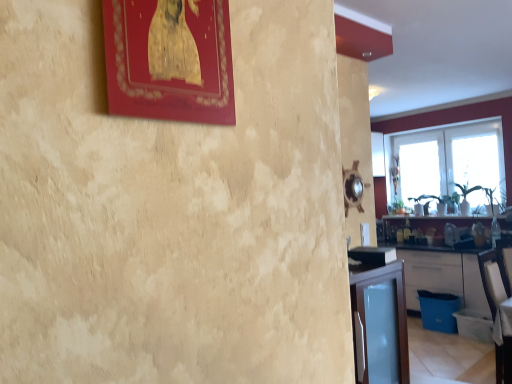
Find the location of `matte gold picture frame at upper left`. matte gold picture frame at upper left is located at coordinates (170, 60).

Locate an element on the screen. This screenshot has height=384, width=512. white matte cabinet at lower right is located at coordinates (443, 275).

Is matte gold picture frame at upper left oriented towards transparent glass window at right, positioned as the second window in back-to-front order?

No, matte gold picture frame at upper left is not turned towards transparent glass window at right, positioned as the second window in back-to-front order.

Is matte gold picture frame at upper left placed right next to transparent glass window at right, positioned as the second window in back-to-front order?

No, matte gold picture frame at upper left is not touching transparent glass window at right, positioned as the second window in back-to-front order.

From a real-world perspective, is matte gold picture frame at upper left located beneath transparent glass window at right, positioned as the second window in back-to-front order?

No, from a real-world perspective, matte gold picture frame at upper left is not beneath transparent glass window at right, positioned as the second window in back-to-front order.

Which of these two, matte gold picture frame at upper left or transparent glass window at right, positioned as the second window in back-to-front order, is smaller?

matte gold picture frame at upper left.

Between white fabric armchair at lower right and transparent glass window at right, which one has smaller size?

Smaller between the two is transparent glass window at right.

In the image, is white fabric armchair at lower right positioned in front of or behind transparent glass window at right?

Clearly, white fabric armchair at lower right is in front of transparent glass window at right.

From the image's perspective, which one is positioned lower, white fabric armchair at lower right or transparent glass window at right?

white fabric armchair at lower right is shown below in the image.

Is transparent glass window at right located within white fabric armchair at lower right?

No, transparent glass window at right is not inside white fabric armchair at lower right.

From a real-world perspective, is transparent glass window at right located higher than white fabric armchair at lower right?

Yes.

Looking at their sizes, would you say transparent glass window at right is wider or thinner than white fabric armchair at lower right?

Considering their sizes, transparent glass window at right looks slimmer than white fabric armchair at lower right.

From the image's perspective, is transparent glass window at right located above or below white fabric armchair at lower right?

Clearly, from the image's perspective, transparent glass window at right is above white fabric armchair at lower right.

Which is behind, point (477, 204) or point (499, 301)?

The point (477, 204) is farther.

Is the position of white matte cabinet at lower right less distant than that of transparent glass window at right, acting as the 1th window starting from the front?

Yes.

Is white matte cabinet at lower right oriented towards transparent glass window at right, acting as the 1th window starting from the front?

No, white matte cabinet at lower right does not turn towards transparent glass window at right, acting as the 1th window starting from the front.

Is white matte cabinet at lower right not inside transparent glass window at right, positioned as the second window in back-to-front order?

Yes, white matte cabinet at lower right is located beyond the bounds of transparent glass window at right, positioned as the second window in back-to-front order.

Is point (410, 147) farther from viewer compared to point (148, 91)?

Yes, point (410, 147) is behind point (148, 91).

Is there a large distance between transparent glass window at upper right, the first window when ordered from back to front, and matte gold picture frame at upper left?

Indeed, transparent glass window at upper right, the first window when ordered from back to front, is not near matte gold picture frame at upper left.

Which object is more forward, transparent glass window at upper right, arranged as the 2th window when viewed from the front, or matte gold picture frame at upper left?

Positioned in front is matte gold picture frame at upper left.

Based on their sizes in the image, would you say transparent glass window at upper right, the first window when ordered from back to front, is bigger or smaller than matte gold picture frame at upper left?

Considering their sizes, transparent glass window at upper right, the first window when ordered from back to front, takes up more space than matte gold picture frame at upper left.

Can you confirm if white fabric armchair at lower right is thinner than transparent glass window at upper right, the first window when ordered from back to front?

No.

How distant is white fabric armchair at lower right from transparent glass window at upper right, the first window when ordered from back to front?

2.91 meters.

Can you tell me how much white fabric armchair at lower right and transparent glass window at upper right, the first window when ordered from back to front, differ in facing direction?

The angular difference between white fabric armchair at lower right and transparent glass window at upper right, the first window when ordered from back to front, is 87 degrees.

Is point (497, 374) closer to camera compared to point (443, 140)?

Yes, point (497, 374) is closer to viewer.

Does transparent glass window at upper right, arranged as the 2th window when viewed from the front, have a greater height compared to transparent glass window at right?

Yes.

Can you tell me how much transparent glass window at upper right, arranged as the 2th window when viewed from the front, and transparent glass window at right differ in facing direction?

They differ by 4.49e-05 degrees in their facing directions.

Which is behind, point (424, 188) or point (479, 203)?

The point (424, 188) is farther.

In the image, there is a transparent glass window at upper right, the first window when ordered from back to front. In order to click on window screen above it (from the image's perspective) in this screenshot , I will do `click(475, 156)`.

Find the location of `window that appears above the matte gold picture frame at upper left (from the image's perspective)`. window that appears above the matte gold picture frame at upper left (from the image's perspective) is located at coordinates (455, 124).

Find the location of a particular element. The width and height of the screenshot is (512, 384). armchair directly beneath the transparent glass window at right (from a real-world perspective) is located at coordinates (492, 281).

Considering their positions, is matte gold picture frame at upper left positioned closer to transparent glass window at right than transparent glass window at upper right, the first window when ordered from back to front?

transparent glass window at upper right, the first window when ordered from back to front.

Considering their positions, is white fabric armchair at lower right positioned closer to transparent glass window at right, acting as the 1th window starting from the front, than transparent glass window at upper right, the first window when ordered from back to front?

transparent glass window at upper right, the first window when ordered from back to front, lies closer to transparent glass window at right, acting as the 1th window starting from the front, than the other object.

Considering their positions, is transparent glass window at right positioned closer to white fabric armchair at lower right than matte gold picture frame at upper left?

transparent glass window at right is closer to white fabric armchair at lower right.

Estimate the real-world distances between objects in this image. Which object is further from white matte cabinet at lower right, transparent glass window at right, acting as the 1th window starting from the front, or transparent glass window at right?

Based on the image, transparent glass window at right, acting as the 1th window starting from the front, appears to be further to white matte cabinet at lower right.

Based on their spatial positions, is transparent glass window at right, positioned as the second window in back-to-front order, or transparent glass window at right closer to transparent glass window at upper right, the first window when ordered from back to front?

transparent glass window at right.

Estimate the real-world distances between objects in this image. Which object is closer to white fabric armchair at lower right, white matte cabinet at lower right or transparent glass window at upper right, the first window when ordered from back to front?

white matte cabinet at lower right is closer to white fabric armchair at lower right.

When comparing their distances from white fabric armchair at lower right, does white matte cabinet at lower right or transparent glass window at right seem closer?

Among the two, white matte cabinet at lower right is located nearer to white fabric armchair at lower right.

Estimate the real-world distances between objects in this image. Which object is closer to transparent glass window at right, positioned as the second window in back-to-front order, transparent glass window at upper right, arranged as the 2th window when viewed from the front, or matte gold picture frame at upper left?

The object closer to transparent glass window at right, positioned as the second window in back-to-front order, is transparent glass window at upper right, arranged as the 2th window when viewed from the front.

Where is `cabinetry between matte gold picture frame at upper left and transparent glass window at right, positioned as the second window in back-to-front order, in the front-back direction`? The height and width of the screenshot is (384, 512). cabinetry between matte gold picture frame at upper left and transparent glass window at right, positioned as the second window in back-to-front order, in the front-back direction is located at coordinates (443, 275).

Find the location of a particular element. Image resolution: width=512 pixels, height=384 pixels. cabinetry between white fabric armchair at lower right and transparent glass window at upper right, arranged as the 2th window when viewed from the front, in the front-back direction is located at coordinates (443, 275).

Identify the location of cabinetry located between white fabric armchair at lower right and transparent glass window at right, acting as the 1th window starting from the front, in the depth direction. This screenshot has width=512, height=384. (443, 275).

You are a GUI agent. You are given a task and a screenshot of the screen. Output one action in this format:
    pyautogui.click(x=<x>, y=<y>)
    Task: Click on the window between matte gold picture frame at upper left and transparent glass window at upper right, arranged as the 2th window when viewed from the front, along the z-axis
    
    Given the screenshot: What is the action you would take?
    pyautogui.click(x=455, y=124)